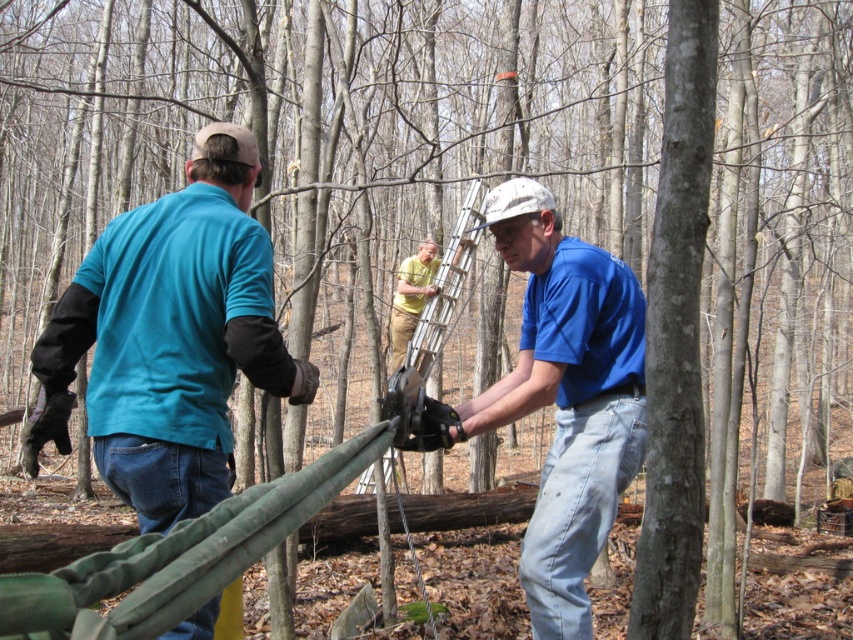
Question: Among these objects, which one is nearest to the camera?

Choices:
 (A) blue fabric at center
 (B) white fabric cap at center
 (C) yellow matte shirt at center

Answer: (A)

Question: Which point is farther to the camera?

Choices:
 (A) white fabric cap at center
 (B) yellow matte shirt at center
 (C) blue fabric at center
 (D) teal fabric shirt at left

Answer: (B)

Question: In this image, where is blue fabric at center located relative to yellow matte shirt at center?

Choices:
 (A) below
 (B) above

Answer: (A)

Question: Considering the relative positions of teal fabric shirt at left and blue fabric at center in the image provided, where is teal fabric shirt at left located with respect to blue fabric at center?

Choices:
 (A) left
 (B) right

Answer: (A)

Question: Which point appears closest to the camera in this image?

Choices:
 (A) click(604, 387)
 (B) click(131, 401)
 (C) click(421, 291)

Answer: (B)

Question: Is blue fabric at center smaller than white fabric cap at center?

Choices:
 (A) no
 (B) yes

Answer: (A)